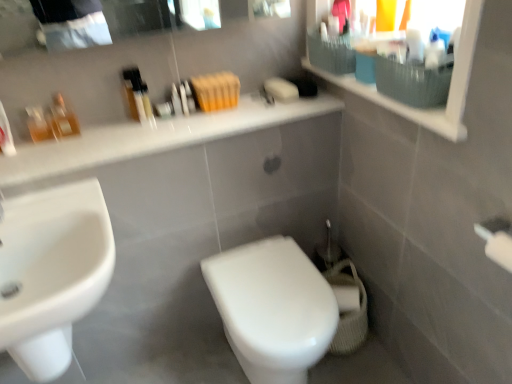
Question: Does white glossy toilet at center lie behind translucent plastic bottles at upper center, the 3th toiletry in the left-to-right sequence?

Choices:
 (A) no
 (B) yes

Answer: (A)

Question: Is translucent plastic bottles at upper center, positioned as the first toiletry in right-to-left order, at the back of white glossy toilet at center?

Choices:
 (A) no
 (B) yes

Answer: (A)

Question: Is white glossy toilet at center not inside translucent plastic bottles at upper center, positioned as the first toiletry in right-to-left order?

Choices:
 (A) no
 (B) yes

Answer: (B)

Question: Is white glossy toilet at center in front of translucent plastic bottles at upper center, positioned as the first toiletry in right-to-left order?

Choices:
 (A) no
 (B) yes

Answer: (B)

Question: Does white glossy toilet at center have a greater width compared to translucent plastic bottles at upper center, the 3th toiletry in the left-to-right sequence?

Choices:
 (A) no
 (B) yes

Answer: (B)

Question: In the image, is white glossy faucet at left on the left side or the right side of translucent glass perfume bottles at upper left, arranged as the 2th toiletry when viewed from the left?

Choices:
 (A) left
 (B) right

Answer: (A)

Question: Is white glossy faucet at left taller or shorter than translucent glass perfume bottles at upper left, arranged as the 2th toiletry when viewed from the left?

Choices:
 (A) short
 (B) tall

Answer: (A)

Question: From a real-world perspective, is white glossy faucet at left physically located above or below translucent glass perfume bottles at upper left, arranged as the 2th toiletry when viewed from the left?

Choices:
 (A) above
 (B) below

Answer: (B)

Question: Is point (2, 215) closer or farther from the camera than point (61, 99)?

Choices:
 (A) farther
 (B) closer

Answer: (B)

Question: In the image, is white glossy countertop at upper center on the left side or the right side of matte white medicine cabinet at upper right?

Choices:
 (A) left
 (B) right

Answer: (A)

Question: Looking at the image, does white glossy countertop at upper center seem bigger or smaller compared to matte white medicine cabinet at upper right?

Choices:
 (A) big
 (B) small

Answer: (A)

Question: Is point (7, 165) closer or farther from the camera than point (385, 97)?

Choices:
 (A) farther
 (B) closer

Answer: (A)

Question: From the image's perspective, is white glossy countertop at upper center above or below matte white medicine cabinet at upper right?

Choices:
 (A) above
 (B) below

Answer: (B)

Question: In terms of width, does white glossy toilet at center look wider or thinner when compared to matte white medicine cabinet at upper right?

Choices:
 (A) wide
 (B) thin

Answer: (A)

Question: Is white glossy toilet at center in front of or behind matte white medicine cabinet at upper right in the image?

Choices:
 (A) behind
 (B) front

Answer: (A)